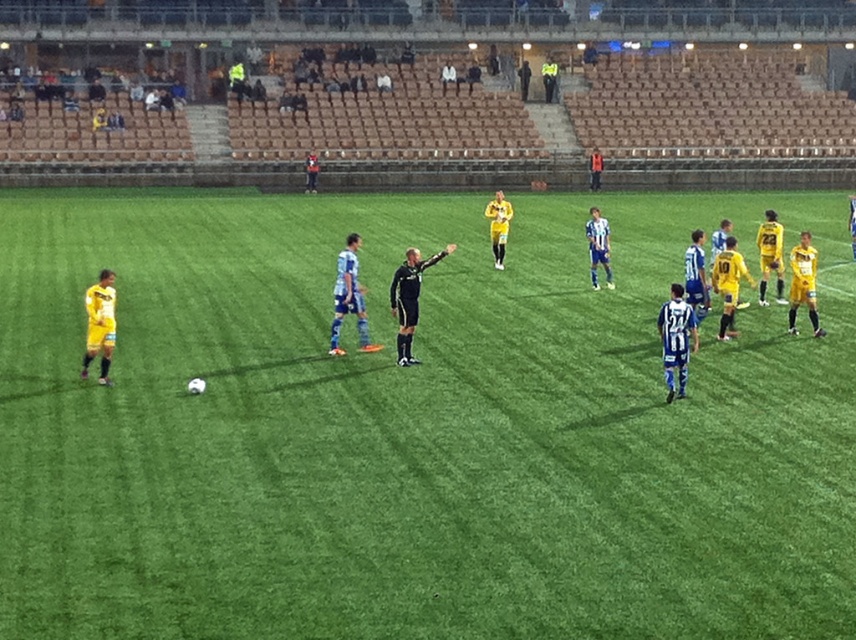
Based on the photo, you are a soccer player wearing a yellow jersey at center. You want to kick the ball to a teammate standing on the green artificial turf at center. Is the ball currently on the same level as your feet?

The green artificial turf at center is positioned under yellow jersey at center, so the ball is on the same level as your feet since the turf is the surface where the jersey is standing.